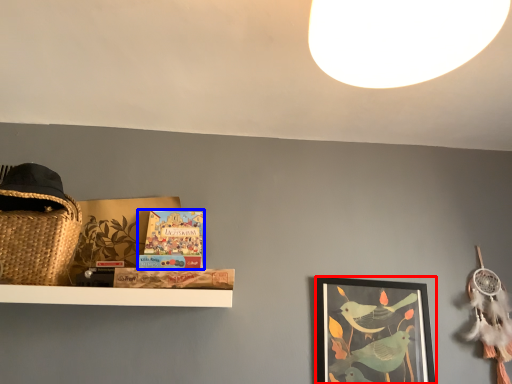
Question: Which object is closer to the camera taking this photo, picture frame (highlighted by a red box) or book (highlighted by a blue box)?

Choices:
 (A) picture frame
 (B) book

Answer: (B)